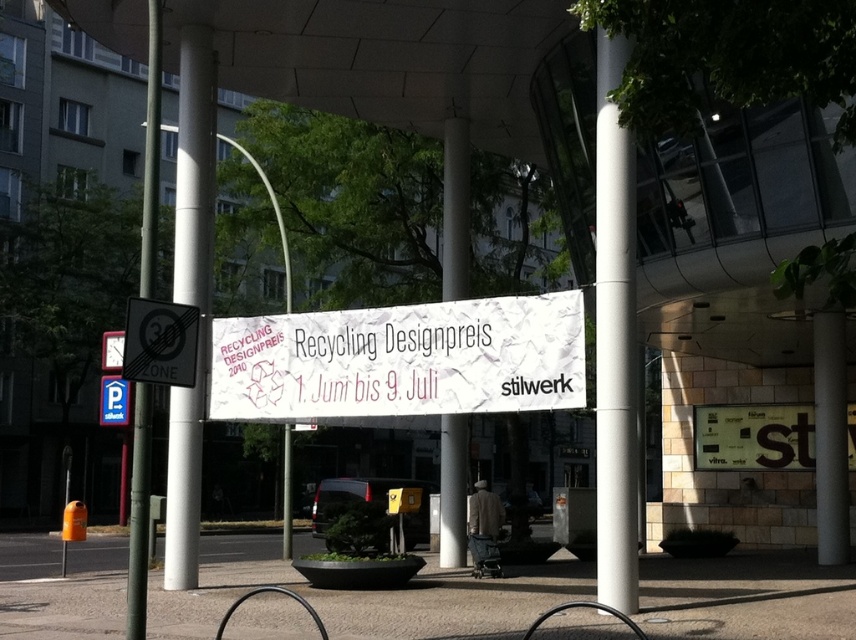
Does white glossy pillar at center have a smaller size compared to metallic pole at center?

Indeed, white glossy pillar at center has a smaller size compared to metallic pole at center.

Who is higher up, white glossy pillar at center or metallic pole at center?

metallic pole at center is higher up.

Does point (447, 563) come closer to viewer compared to point (289, 529)?

That is True.

Where is `white glossy pillar at center`? white glossy pillar at center is located at coordinates (455, 209).

Which of these two, green metallic pole at left or black reflective zone sign at left, stands taller?

green metallic pole at left is taller.

Measure the distance between green metallic pole at left and black reflective zone sign at left.

green metallic pole at left is 14.10 feet from black reflective zone sign at left.

Between point (146, 408) and point (134, 358), which one is positioned in front?

Point (134, 358) is more forward.

The height and width of the screenshot is (640, 856). I want to click on green metallic pole at left, so click(138, 515).

Looking at this image, who is more distant from viewer, (149, 284) or (444, 170)?

Point (444, 170)

Is green metallic pole at left to the right of white glossy pillar at center from the viewer's perspective?

No, green metallic pole at left is not to the right of white glossy pillar at center.

Which is in front, point (132, 570) or point (444, 157)?

Point (132, 570) is more forward.

Locate an element on the screen. The image size is (856, 640). green metallic pole at left is located at coordinates (138, 515).